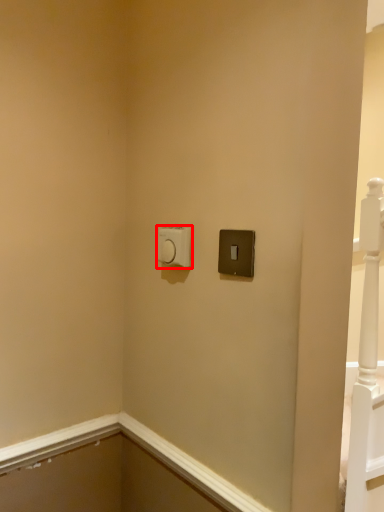
Question: From the image, what is the correct spatial relationship of light switch (annotated by the red box) in relation to light switch?

Choices:
 (A) left
 (B) right

Answer: (A)